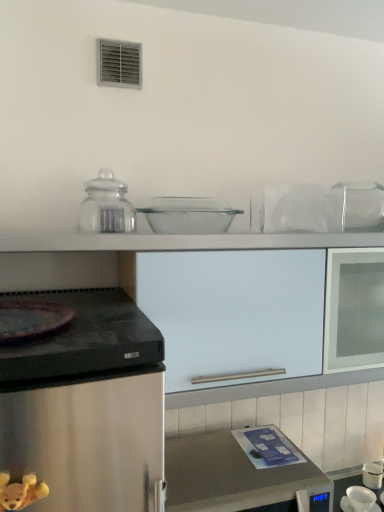
Question: Is transparent glass jar at upper center wider or thinner than white matte cabinet at center?

Choices:
 (A) wide
 (B) thin

Answer: (B)

Question: From the image's perspective, is transparent glass jar at upper center positioned above or below white matte cabinet at center?

Choices:
 (A) above
 (B) below

Answer: (A)

Question: Which object is the closest to the brown plush bear at lower left?

Choices:
 (A) clear glass bowl at center, the 2th appliance viewed from the right
 (B) white glossy cup at lower right, which ranks as the 2th appliance in front-to-back order
 (C) transparent glass jar at upper center
 (D) white matte cabinet at center
 (E) metallic stainless steel microwave at lower center

Answer: (C)

Question: Which object is positioned closest to the brown plush bear at lower left?

Choices:
 (A) clear glass bowl at center, the second appliance positioned from the bottom
 (B) transparent glass jar at upper center
 (C) metallic stainless steel microwave at lower center
 (D) white glossy cup at lower right, which appears as the 2th appliance when viewed from the top
 (E) white matte cabinet at center

Answer: (B)